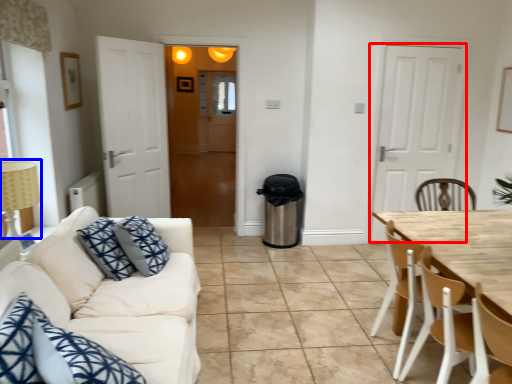
Question: Which point is further to the camera, door (highlighted by a red box) or lamp (highlighted by a blue box)?

Choices:
 (A) door
 (B) lamp

Answer: (A)